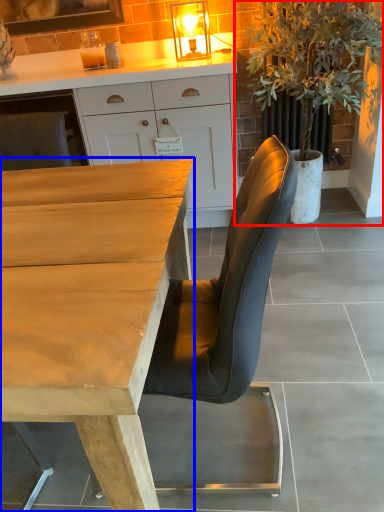
Question: Which point is closer to the camera, houseplant (highlighted by a red box) or desk (highlighted by a blue box)?

Choices:
 (A) houseplant
 (B) desk

Answer: (B)